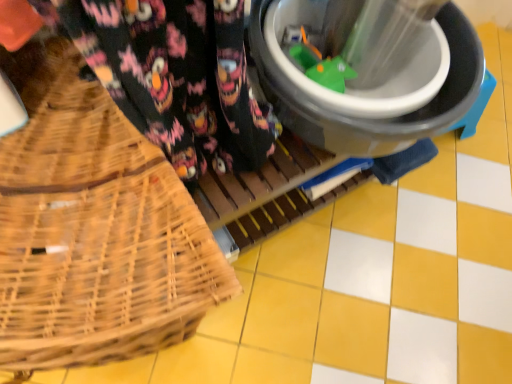
Question: Is woven wood picnic basket at left thinner than black plastic bucket at center?

Choices:
 (A) no
 (B) yes

Answer: (A)

Question: From the image's perspective, is woven wood picnic basket at left on top of black plastic bucket at center?

Choices:
 (A) yes
 (B) no

Answer: (B)

Question: Is woven wood picnic basket at left oriented towards black plastic bucket at center?

Choices:
 (A) no
 (B) yes

Answer: (A)

Question: Considering the relative sizes of woven wood picnic basket at left and black plastic bucket at center in the image provided, is woven wood picnic basket at left taller than black plastic bucket at center?

Choices:
 (A) no
 (B) yes

Answer: (B)

Question: Would you say woven wood picnic basket at left is a long distance from black plastic bucket at center?

Choices:
 (A) no
 (B) yes

Answer: (A)

Question: From a real-world perspective, is woven wood picnic basket at left over black plastic bucket at center?

Choices:
 (A) yes
 (B) no

Answer: (B)

Question: Is black plastic bucket at center positioned before woven wood picnic basket at left?

Choices:
 (A) no
 (B) yes

Answer: (A)

Question: Can you confirm if black plastic bucket at center is positioned to the left of woven wood picnic basket at left?

Choices:
 (A) no
 (B) yes

Answer: (A)

Question: Is black plastic bucket at center oriented away from woven wood picnic basket at left?

Choices:
 (A) yes
 (B) no

Answer: (B)

Question: Would you say black plastic bucket at center contains woven wood picnic basket at left?

Choices:
 (A) yes
 (B) no

Answer: (B)

Question: Considering the relative sizes of black plastic bucket at center and woven wood picnic basket at left in the image provided, is black plastic bucket at center shorter than woven wood picnic basket at left?

Choices:
 (A) no
 (B) yes

Answer: (B)

Question: From a real-world perspective, is black plastic bucket at center on woven wood picnic basket at left?

Choices:
 (A) yes
 (B) no

Answer: (A)

Question: From the image's perspective, relative to black plastic bucket at center, is woven wood picnic basket at left above or below?

Choices:
 (A) above
 (B) below

Answer: (B)